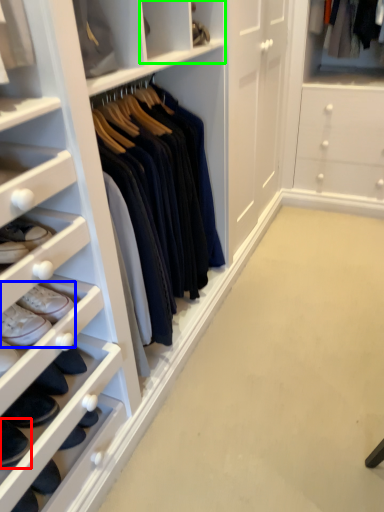
Question: Which is farther away from footwear (highlighted by a red box)? footwear (highlighted by a blue box) or cabinet (highlighted by a green box)?

Choices:
 (A) footwear
 (B) cabinet

Answer: (B)